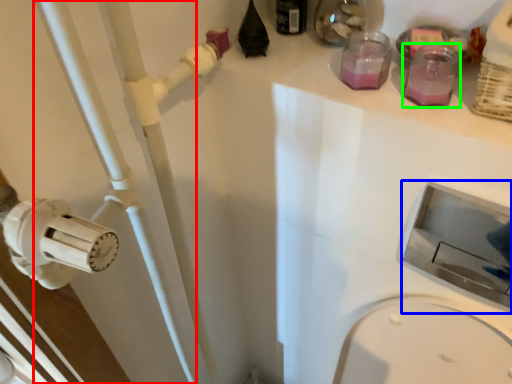
Question: Which object is positioned closest to pipe (highlighted by a red box)? Select from sink (highlighted by a blue box) and bottle (highlighted by a green box).

Choices:
 (A) sink
 (B) bottle

Answer: (B)